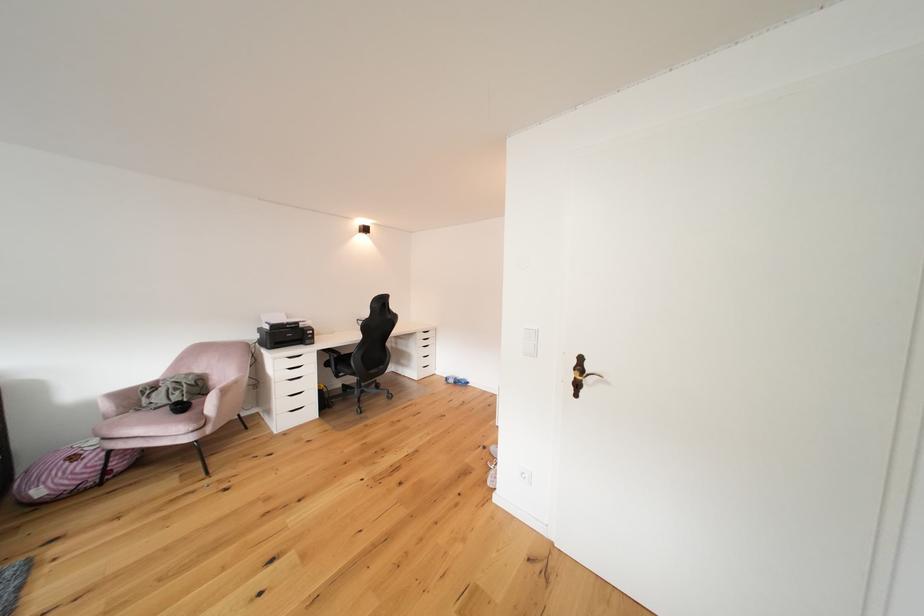
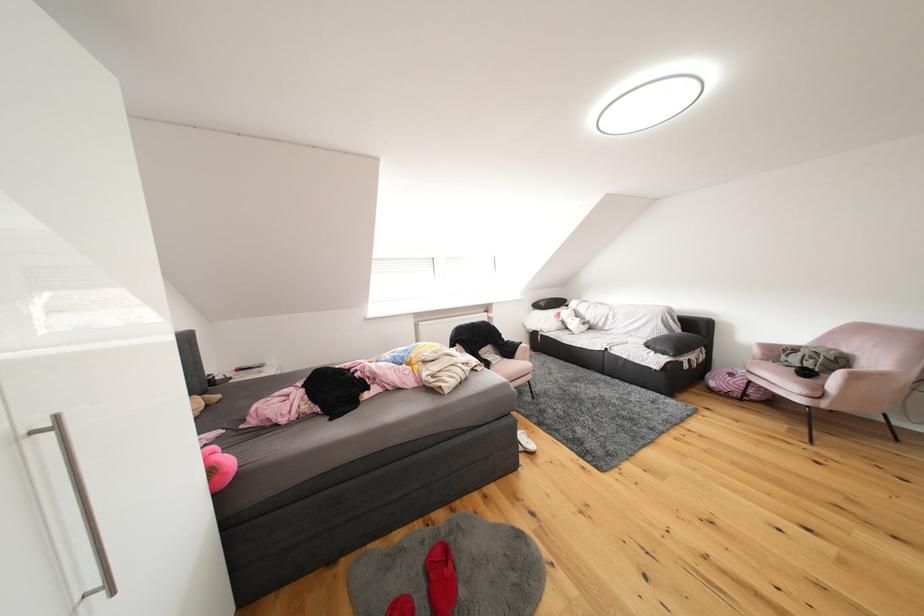
Locate, in the second image, the point that corresponds to pixel 181 437 in the first image.

(797, 392)